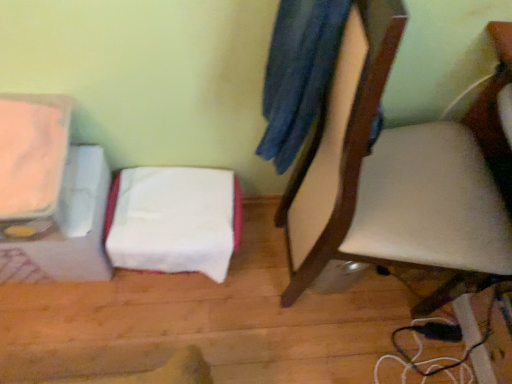
Locate an element on the screen. unoccupied region to the right of white fabric at lower left is located at coordinates (266, 275).